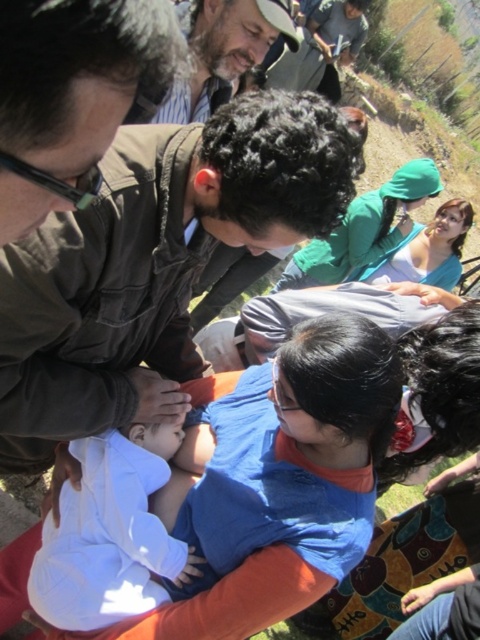
Question: Which object is closer to the camera taking this photo?

Choices:
 (A) brown leather hat at upper center
 (B) brown leather jacket at center
 (C) white soft baby at center

Answer: (B)

Question: Where is white soft baby at center located in relation to brown leather hat at upper center in the image?

Choices:
 (A) right
 (B) left

Answer: (B)

Question: Can you confirm if brown leather jacket at center is bigger than brown leather hat at upper center?

Choices:
 (A) yes
 (B) no

Answer: (A)

Question: Is white soft baby at center above brown leather hat at upper center?

Choices:
 (A) yes
 (B) no

Answer: (B)

Question: Which of these objects is positioned farthest from the brown leather hat at upper center?

Choices:
 (A) brown leather jacket at center
 (B) white soft baby at center

Answer: (B)

Question: Which object appears closest to the camera in this image?

Choices:
 (A) brown leather jacket at center
 (B) white soft baby at center
 (C) brown leather hat at upper center

Answer: (A)